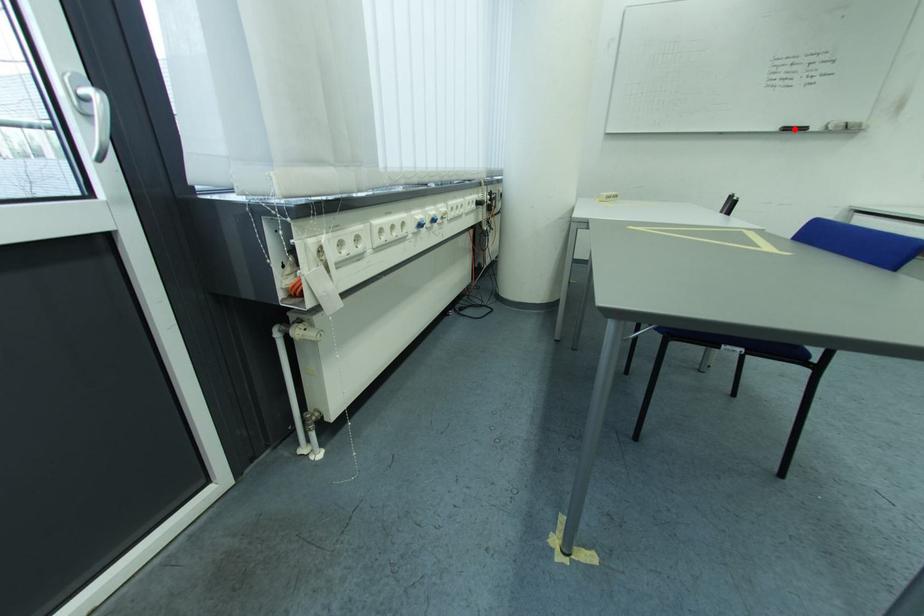
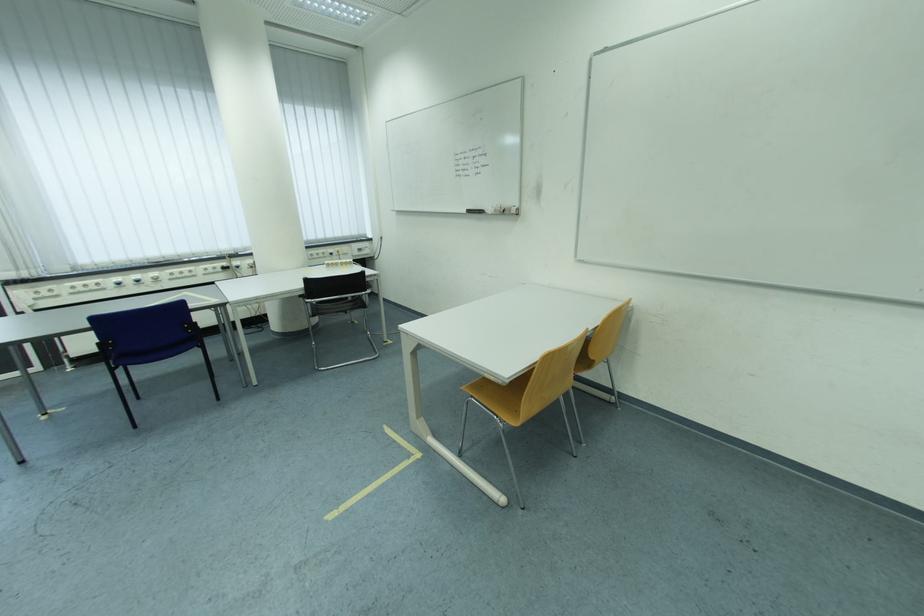
Question: I am providing you with two images of the same scene from different viewpoints. In image1, a red point is highlighted. Considering the same 3D point in image2, which of the following is correct?

Choices:
 (A) It is closer
 (B) It is farther

Answer: (A)